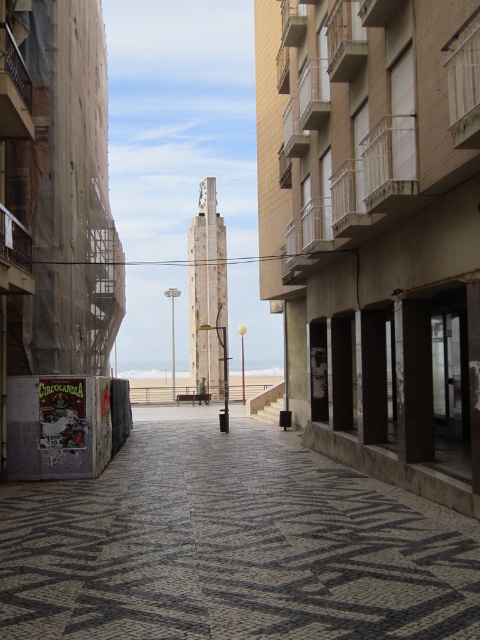
You are a pedestrian standing at the edge of the street facing the beach. You see the black textured pavement at center and the white sand at center. Which one is closer to your right side?

The black textured pavement at center is to the right of white sand at center, so it is closer to your right side.

You are standing at the point marked by the coordinates point [231,545] in the image. Looking around, you see the black textured pavement at center. What is the immediate surface beneath your feet?

The immediate surface beneath your feet is the black textured pavement at center marked by the coordinates point [231,545].

What are the coordinates of the black textured pavement at center in the image?

The black textured pavement at center is located at coordinates point (231, 545).